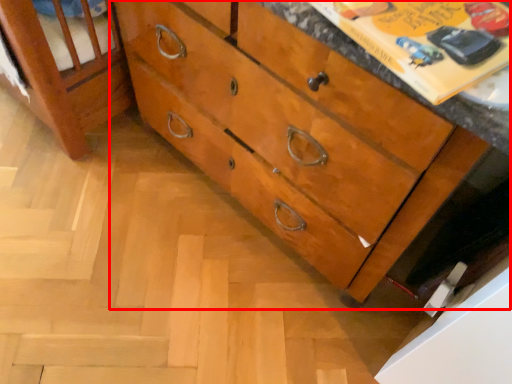
Question: From the image's perspective, considering the relative positions of chest of drawers (annotated by the red box) and paperback book in the image provided, where is chest of drawers (annotated by the red box) located with respect to the staircase?

Choices:
 (A) above
 (B) below

Answer: (A)